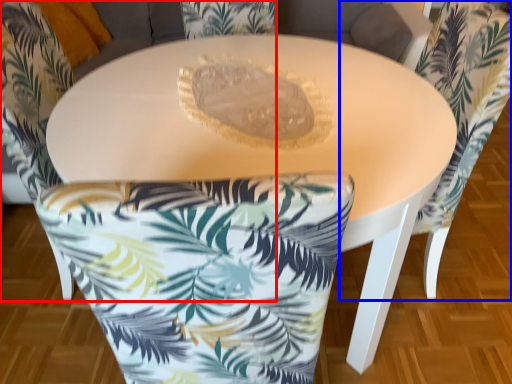
Question: Which point is further to the camera, chair (highlighted by a red box) or chair (highlighted by a blue box)?

Choices:
 (A) chair
 (B) chair

Answer: (B)